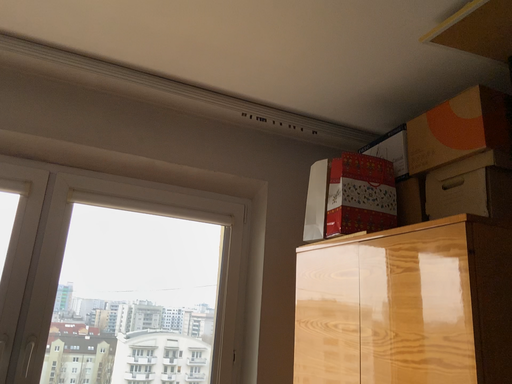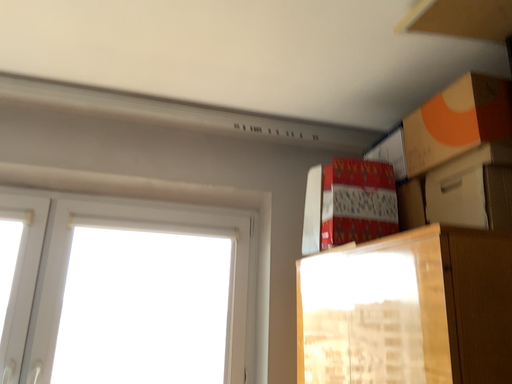
Question: How did the camera likely rotate when shooting the video?

Choices:
 (A) rotated left
 (B) rotated right

Answer: (A)